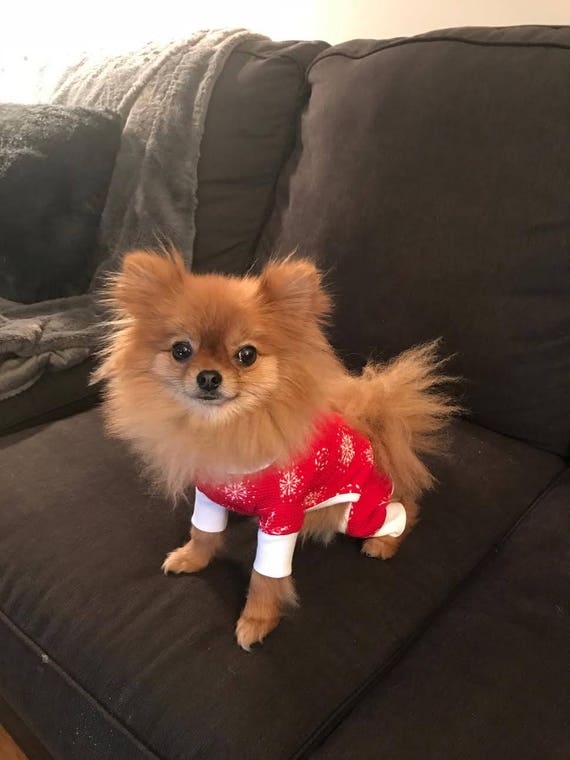
The image size is (570, 760). What are the coordinates of `couch` in the screenshot? It's located at (85, 597).